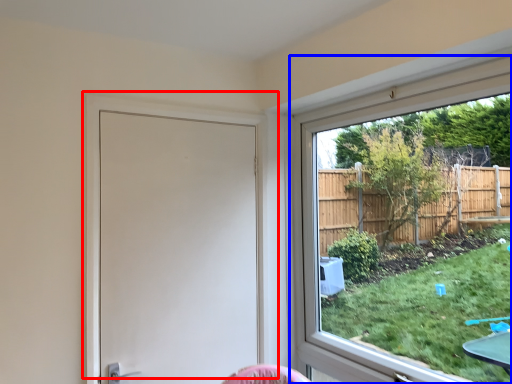
Question: Which object is closer to the camera taking this photo, door (highlighted by a red box) or window (highlighted by a blue box)?

Choices:
 (A) door
 (B) window

Answer: (B)